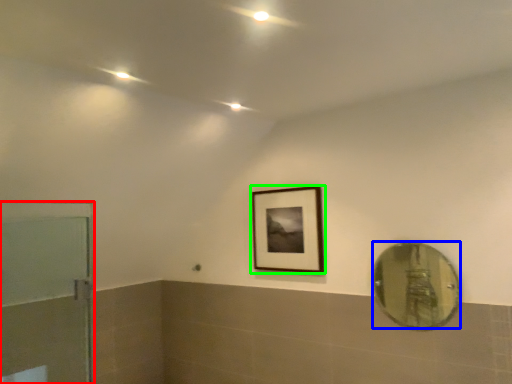
Question: Estimate the real-world distances between objects in this image. Which object is closer to door (highlighted by a red box), mirror (highlighted by a blue box) or picture frame (highlighted by a green box)?

Choices:
 (A) mirror
 (B) picture frame

Answer: (B)